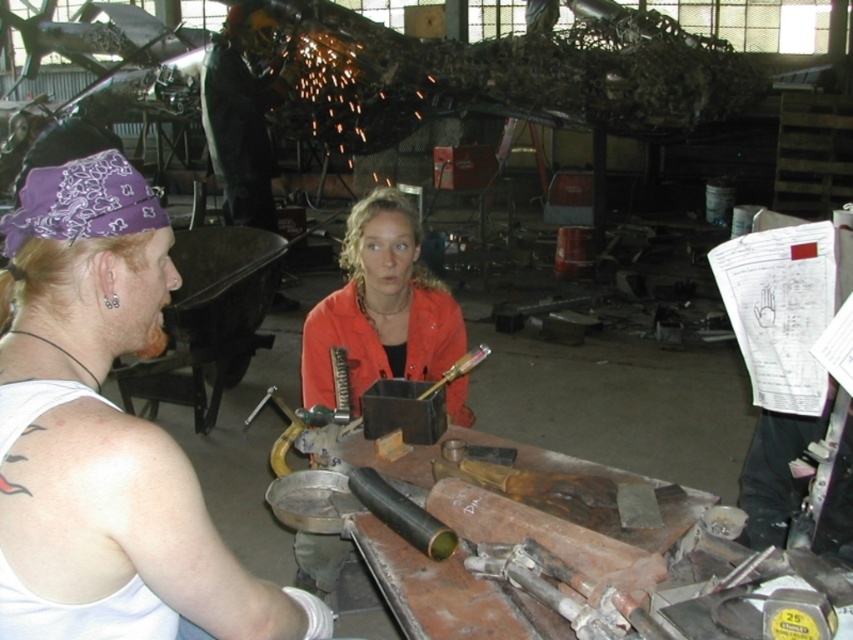
Who is higher up, orange matte jacket at center or shiny black helmet at upper center?

shiny black helmet at upper center is above.

Consider the image. Can you confirm if orange matte jacket at center is taller than shiny black helmet at upper center?

No.

What are the coordinates of `orange matte jacket at center` in the screenshot? It's located at (380, 307).

Which of these two, purple bandana at left or orange matte jacket at center, stands shorter?

Standing shorter between the two is purple bandana at left.

Looking at this image, is purple bandana at left below orange matte jacket at center?

Yes.

Does point (109, 189) lie behind point (361, 330)?

No, (109, 189) is closer to viewer.

Where is `purple bandana at left`? The width and height of the screenshot is (853, 640). purple bandana at left is located at coordinates (108, 428).

Between purple bandana at left and shiny black helmet at upper center, which one has more height?

shiny black helmet at upper center

Is purple bandana at left further to camera compared to shiny black helmet at upper center?

No, it is in front of shiny black helmet at upper center.

What do you see at coordinates (108, 428) in the screenshot? The width and height of the screenshot is (853, 640). I see `purple bandana at left` at bounding box center [108, 428].

Identify the location of purple bandana at left. Image resolution: width=853 pixels, height=640 pixels. (108, 428).